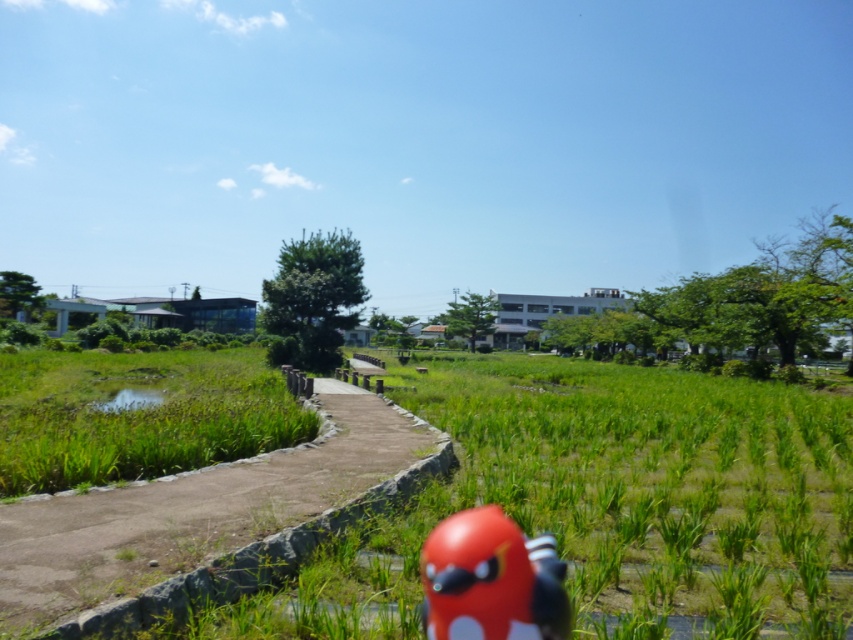
Looking at this image, does smooth concrete path at center appear over shiny red toy at center?

No.

Can you confirm if smooth concrete path at center is bigger than shiny red toy at center?

Indeed, smooth concrete path at center has a larger size compared to shiny red toy at center.

Between point (125, 541) and point (517, 540), which one is positioned in front?

Positioned in front is point (517, 540).

In order to click on smooth concrete path at center in this screenshot , I will do tap(192, 512).